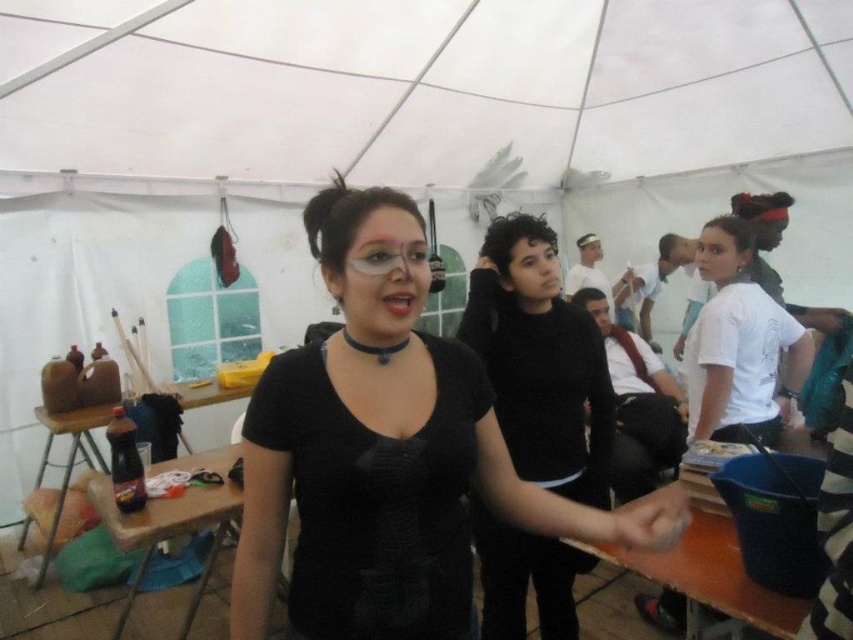
You are a photographer standing at the entrance of the tent. You want to take a photo of the matte black shirt at center and the brown plastic table at lower left. Can you fit both subjects in the frame if your camera has a 5 feet wide field of view?

The matte black shirt at center and brown plastic table at lower left are 3.62 feet apart. Since the distance between them is less than the 5 feet field of view, both subjects can be captured in the same frame.

You are a guest at this event and want to place a 12 inch long object on the surface between the black matte sweater at center and the brown wooden table at lower right. Will there be enough space for it?

The distance between the black matte sweater at center and the brown wooden table at lower right is 14.58 inches. Since the object is 12 inches long, there is sufficient space to place it between them.